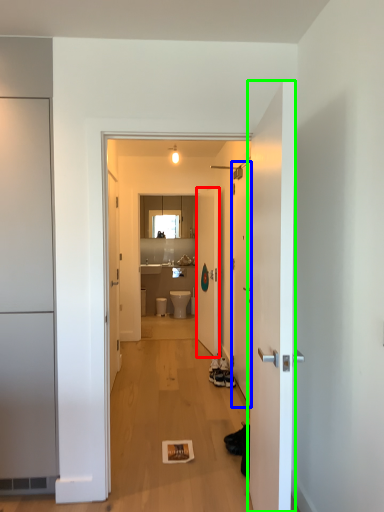
Question: Based on their relative distances, which object is nearer to door (highlighted by a red box)? Choose from door (highlighted by a blue box) and door (highlighted by a green box).

Choices:
 (A) door
 (B) door

Answer: (A)